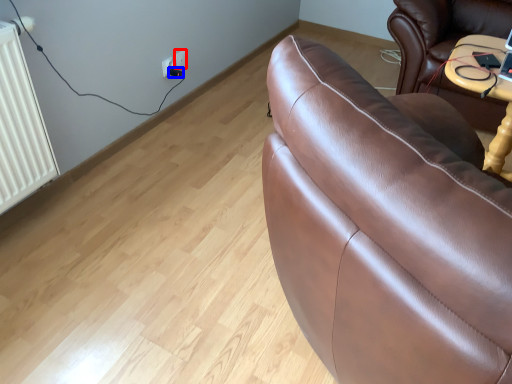
Question: Among these objects, which one is nearest to the camera, electric outlet (highlighted by a red box) or plug (highlighted by a blue box)?

Choices:
 (A) electric outlet
 (B) plug

Answer: (B)